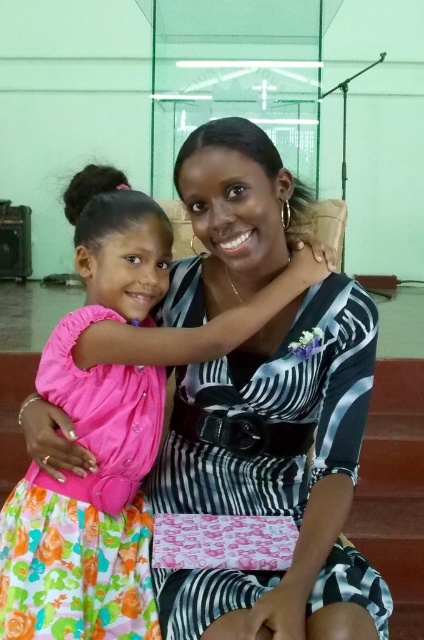
Does pink satin dress at center have a larger size compared to pink satin dress at left?

Yes, pink satin dress at center is bigger than pink satin dress at left.

Consider the image. Which of these two, pink satin dress at center or pink satin dress at left, stands shorter?

pink satin dress at left is shorter.

Where is `pink satin dress at center`? pink satin dress at center is located at coordinates (147, 301).